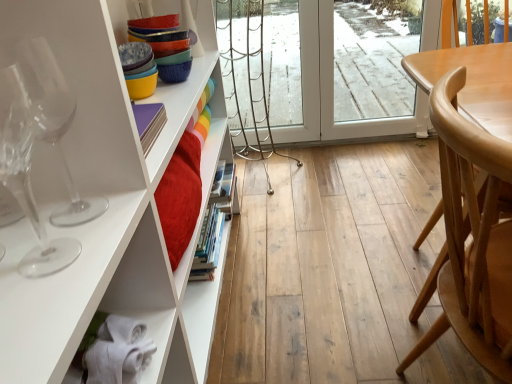
Question: Relative to transparent glass wine glass at left, the second wine glass in the front-to-back sequence, is transparent glass wine glass at left, the first wine glass viewed from the front, in front or behind?

Choices:
 (A) front
 (B) behind

Answer: (A)

Question: Considering the positions of transparent glass wine glass at left, arranged as the second wine glass when viewed from the back, and transparent glass wine glass at left, the second wine glass in the front-to-back sequence, in the image, is transparent glass wine glass at left, arranged as the second wine glass when viewed from the back, wider or thinner than transparent glass wine glass at left, the second wine glass in the front-to-back sequence,?

Choices:
 (A) thin
 (B) wide

Answer: (B)

Question: Estimate the real-world distances between objects in this image. Which object is closer to the transparent glass wine glass at left, the 1th wine glass when ordered from back to front?

Choices:
 (A) light brown wood chair at right
 (B) transparent glass wine glass at left, arranged as the second wine glass when viewed from the back

Answer: (B)

Question: Estimate the real-world distances between objects in this image. Which object is closer to the transparent glass wine glass at left, the first wine glass viewed from the front?

Choices:
 (A) transparent glass wine glass at left, the second wine glass in the front-to-back sequence
 (B) light brown wood chair at right

Answer: (A)